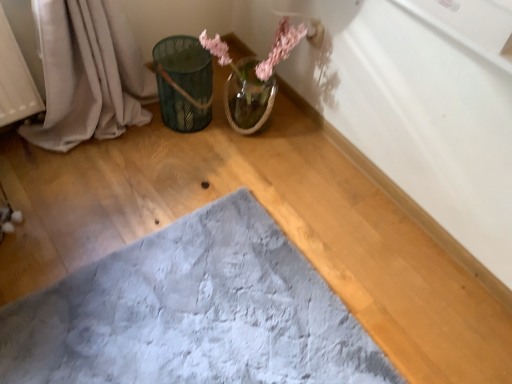
At what (x,y) coordinates should I click in order to perform the action: click on vacant space that is in between soft gray plush bath mat at center and green metallic bucket at upper left. Please return your answer as a coordinate pair (x, y). This screenshot has width=512, height=384. Looking at the image, I should click on (165, 200).